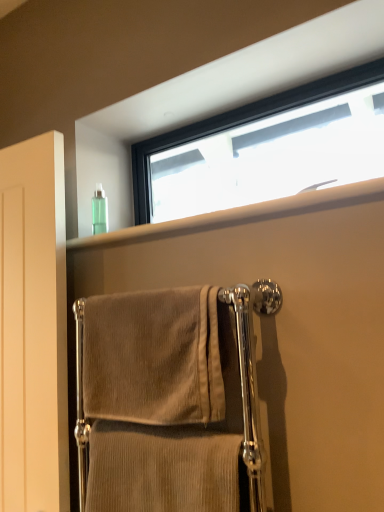
What do you see at coordinates (153, 357) in the screenshot?
I see `beige corduroy towel at center, the 2th towel in the bottom-to-top sequence` at bounding box center [153, 357].

What is the approximate height of matte white door at left?

matte white door at left is 3.42 feet in height.

At what (x,y) coordinates should I click in order to perform the action: click on clear plastic bottle at upper center. Please return your answer as a coordinate pair (x, y). The image size is (384, 512). Looking at the image, I should click on (242, 214).

In terms of height, does beige corduroy towel at center, the first towel when ordered from bottom to top, look taller or shorter compared to green translucent bottle at upper left?

Clearly, beige corduroy towel at center, the first towel when ordered from bottom to top, is taller compared to green translucent bottle at upper left.

From the image's perspective, which one is positioned higher, beige corduroy towel at center, the second towel from the top, or green translucent bottle at upper left?

green translucent bottle at upper left, from the image's perspective.

Is beige corduroy towel at center, the second towel from the top, inside or outside of green translucent bottle at upper left?

beige corduroy towel at center, the second towel from the top, is outside green translucent bottle at upper left.

From the image's perspective, between matte white door at left and beige corduroy towel at center, the first towel when ordered from bottom to top, which one is located above?

matte white door at left.

Is the surface of matte white door at left in direct contact with beige corduroy towel at center, the first towel when ordered from bottom to top?

matte white door at left is not next to beige corduroy towel at center, the first towel when ordered from bottom to top, and they're not touching.

How different are the orientations of matte white door at left and beige corduroy towel at center, the first towel when ordered from bottom to top, in degrees?

The facing directions of matte white door at left and beige corduroy towel at center, the first towel when ordered from bottom to top, are 1.4 degrees apart.

Which object is further away from the camera, matte white door at left or beige corduroy towel at center, the first towel when ordered from bottom to top?

matte white door at left is more distant.

Which is behind, point (45, 432) or point (335, 206)?

Positioned behind is point (45, 432).

How far apart are matte white door at left and clear plastic bottle at upper center?

The distance of matte white door at left from clear plastic bottle at upper center is 12.98 inches.

Consider the image. How many degrees apart are the facing directions of matte white door at left and clear plastic bottle at upper center?

There is a 2.37-degree angle between the facing directions of matte white door at left and clear plastic bottle at upper center.

Is matte white door at left situated inside clear plastic bottle at upper center or outside?

matte white door at left is located beyond the bounds of clear plastic bottle at upper center.

Does point (39, 383) lie in front of point (370, 134)?

That is True.

The width and height of the screenshot is (384, 512). In order to click on window on the right of matte white door at left in this screenshot , I will do `click(266, 149)`.

From a real-world perspective, is matte white door at left physically above black frame window at upper center?

No.

Is matte white door at left inside the boundaries of black frame window at upper center, or outside?

The correct answer is: outside.

Is point (233, 434) closer or farther from the camera than point (1, 495)?

Point (233, 434) is closer to the camera than point (1, 495).

Is beige corduroy towel at center, the first towel when ordered from bottom to top, positioned with its back to matte white door at left?

beige corduroy towel at center, the first towel when ordered from bottom to top, is not turned away from matte white door at left.

What's the angular difference between beige corduroy towel at center, the second towel from the top, and matte white door at left's facing directions?

They differ by 1.4 degrees in their facing directions.

From the image's perspective, is green translucent bottle at upper left located beneath beige corduroy towel at center, the first towel when ordered from bottom to top?

Actually, green translucent bottle at upper left appears above beige corduroy towel at center, the first towel when ordered from bottom to top, in the image.

Does green translucent bottle at upper left have a smaller size compared to beige corduroy towel at center, the second towel from the top?

Indeed, green translucent bottle at upper left has a smaller size compared to beige corduroy towel at center, the second towel from the top.

From the picture: Can you confirm if green translucent bottle at upper left is thinner than beige corduroy towel at center, the first towel when ordered from bottom to top?

Indeed, green translucent bottle at upper left has a lesser width compared to beige corduroy towel at center, the first towel when ordered from bottom to top.

The image size is (384, 512). I want to click on towel behind the beige corduroy towel at center, the first towel when ordered from bottom to top, so click(153, 357).

Considering the positions of objects beige corduroy towel at center, the second towel from the top, and beige corduroy towel at center, the 2th towel in the bottom-to-top sequence, in the image provided, who is more to the left, beige corduroy towel at center, the second towel from the top, or beige corduroy towel at center, the 2th towel in the bottom-to-top sequence,?

beige corduroy towel at center, the 2th towel in the bottom-to-top sequence, is more to the left.

Considering the positions of objects beige corduroy towel at center, the first towel when ordered from bottom to top, and beige corduroy towel at center, marked as the 1th towel in a top-to-bottom arrangement, in the image provided, who is behind, beige corduroy towel at center, the first towel when ordered from bottom to top, or beige corduroy towel at center, marked as the 1th towel in a top-to-bottom arrangement,?

beige corduroy towel at center, marked as the 1th towel in a top-to-bottom arrangement, is further from the camera.

Is point (124, 503) closer to camera compared to point (178, 309)?

No, it is not.

This screenshot has width=384, height=512. Identify the location of the 2nd towel in front of the green translucent bottle at upper left. (164, 469).

At what (x,y) coordinates should I click in order to perform the action: click on screen door on the left of beige corduroy towel at center, the second towel from the top. Please return your answer as a coordinate pair (x, y). The image size is (384, 512). Looking at the image, I should click on (33, 327).

From the image, which object appears to be nearer to green translucent bottle at upper left, beige corduroy towel at center, the second towel from the top, or clear plastic bottle at upper center?

Among the two, clear plastic bottle at upper center is located nearer to green translucent bottle at upper left.

When comparing their distances from matte white door at left, does black frame window at upper center or clear plastic bottle at upper center seem further?

black frame window at upper center lies further to matte white door at left than the other object.

When comparing their distances from beige corduroy towel at center, the 2th towel in the bottom-to-top sequence, does clear plastic bottle at upper center or black frame window at upper center seem closer?

clear plastic bottle at upper center is closer to beige corduroy towel at center, the 2th towel in the bottom-to-top sequence.

Which object lies nearer to the anchor point black frame window at upper center, beige corduroy towel at center, the second towel from the top, or beige corduroy towel at center, the 2th towel in the bottom-to-top sequence?

beige corduroy towel at center, the 2th towel in the bottom-to-top sequence, is closer to black frame window at upper center.

From the image, which object appears to be farther from black frame window at upper center, beige corduroy towel at center, the first towel when ordered from bottom to top, or matte white door at left?

beige corduroy towel at center, the first towel when ordered from bottom to top, is positioned further to the anchor black frame window at upper center.

When comparing their distances from matte white door at left, does beige corduroy towel at center, the 2th towel in the bottom-to-top sequence, or beige corduroy towel at center, the first towel when ordered from bottom to top, seem further?

beige corduroy towel at center, the first towel when ordered from bottom to top, is positioned further to the anchor matte white door at left.

Estimate the real-world distances between objects in this image. Which object is further from beige corduroy towel at center, the second towel from the top, matte white door at left or beige corduroy towel at center, the 2th towel in the bottom-to-top sequence?

matte white door at left is positioned further to the anchor beige corduroy towel at center, the second towel from the top.

Consider the image. Looking at the image, which one is located further to matte white door at left, green translucent bottle at upper left or clear plastic bottle at upper center?

green translucent bottle at upper left.

At what (x,y) coordinates should I click in order to perform the action: click on towel between matte white door at left and beige corduroy towel at center, the first towel when ordered from bottom to top, in the horizontal direction. Please return your answer as a coordinate pair (x, y). Looking at the image, I should click on (153, 357).

Locate an element on the screen. towel between beige corduroy towel at center, the second towel from the top, and green translucent bottle at upper left in the front-back direction is located at coordinates pyautogui.click(x=153, y=357).

Identify the location of toiletry between matte white door at left and black frame window at upper center. The image size is (384, 512). (99, 211).

Image resolution: width=384 pixels, height=512 pixels. I want to click on toiletry between matte white door at left and clear plastic bottle at upper center in the horizontal direction, so click(x=99, y=211).